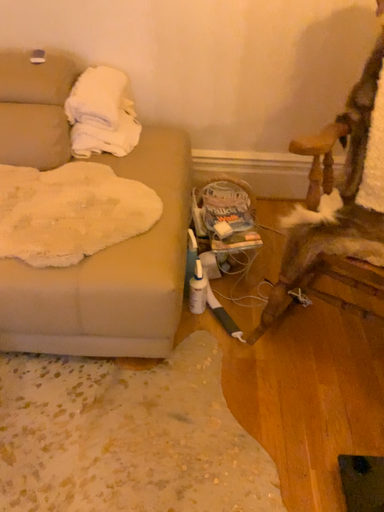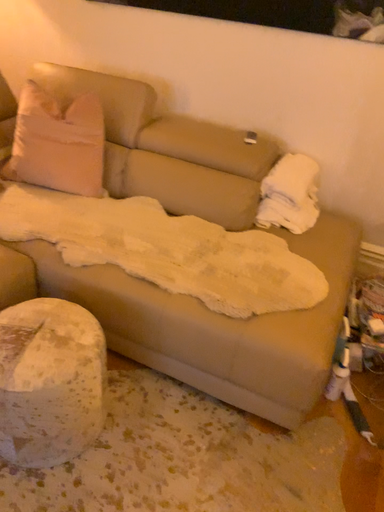
Question: How did the camera likely rotate when shooting the video?

Choices:
 (A) rotated downward
 (B) rotated upward

Answer: (B)